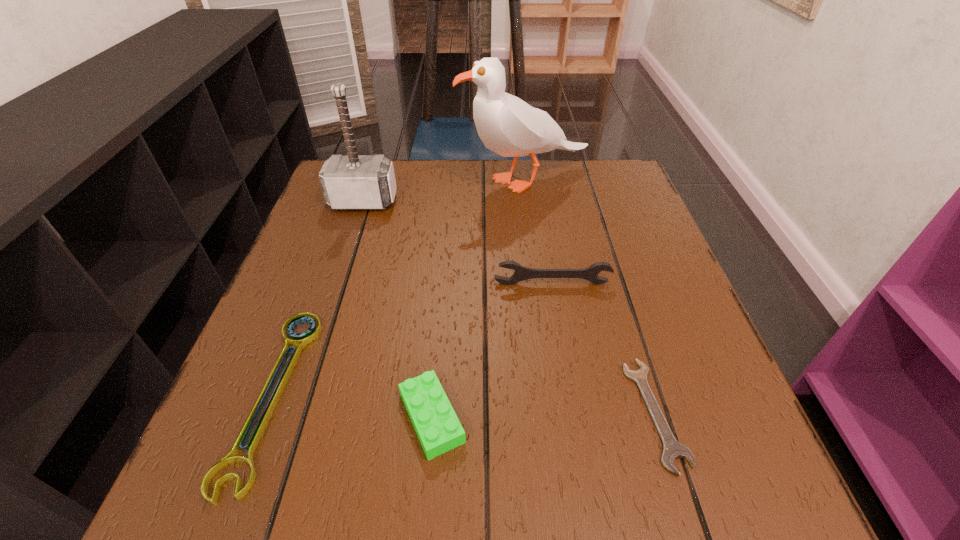
Locate an element on the screen. gull is located at coordinates (508, 126).

This screenshot has height=540, width=960. What are the coordinates of `hammer` in the screenshot? It's located at (350, 182).

Locate an element on the screen. Image resolution: width=960 pixels, height=540 pixels. the fourth nearest object is located at coordinates (521, 273).

Where is `the third tallest object`? The height and width of the screenshot is (540, 960). the third tallest object is located at coordinates (521, 273).

What are the coordinates of `the fourth tallest object` in the screenshot? It's located at (438, 428).

Locate an element on the screen. Image resolution: width=960 pixels, height=540 pixels. the leftmost wrench is located at coordinates (301, 340).

The height and width of the screenshot is (540, 960). I want to click on the second shortest object, so click(301, 340).

You are a GUI agent. You are given a task and a screenshot of the screen. Output one action in this format:
    pyautogui.click(x=<x>, y=<y>)
    Task: Click on the shortest wrench
    
    Given the screenshot: What is the action you would take?
    pyautogui.click(x=672, y=449)

This screenshot has height=540, width=960. Identify the location of vacant area situated 0.320m at the beak of the gull. (337, 180).

At what (x,y) coordinates should I click in order to perform the action: click on vacant space located at the beak of the gull. Please return your answer as a coordinate pair (x, y). This screenshot has width=960, height=540. Looking at the image, I should click on (333, 180).